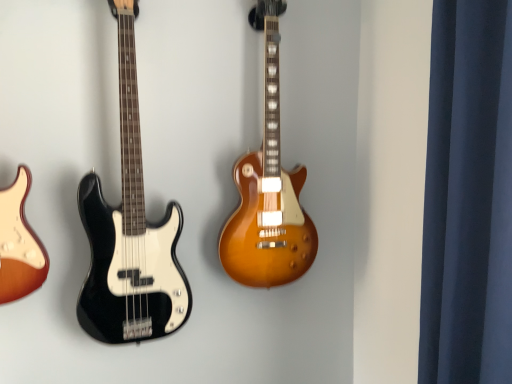
Question: Considering their positions, is satin sunburst guitar at center, which is counted as the 1th guitar, starting from the right, located in front of or behind black glossy bass guitar at left, which is the 1th guitar from left to right?

Choices:
 (A) front
 (B) behind

Answer: (B)

Question: From the image's perspective, relative to black glossy bass guitar at left, which is the 2th guitar in right-to-left order, is satin sunburst guitar at center, which appears as the 2th guitar when viewed from the left, above or below?

Choices:
 (A) below
 (B) above

Answer: (B)

Question: Which is nearer to the dark blue fabric at right?

Choices:
 (A) black glossy bass guitar at left, which is the 2th guitar in right-to-left order
 (B) satin sunburst guitar at center, which is counted as the 1th guitar, starting from the right

Answer: (B)

Question: Which is farther from the dark blue fabric at right?

Choices:
 (A) black glossy bass guitar at left, which is the 2th guitar in right-to-left order
 (B) satin sunburst guitar at center, which appears as the 2th guitar when viewed from the left

Answer: (A)